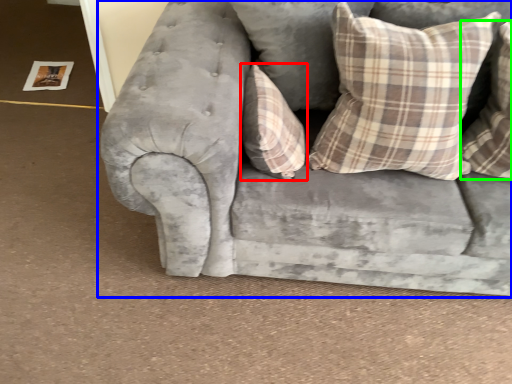
Question: Which object is the closest to the pillow (highlighted by a red box)? Choose among these: studio couch (highlighted by a blue box) or pillow (highlighted by a green box).

Choices:
 (A) studio couch
 (B) pillow

Answer: (A)